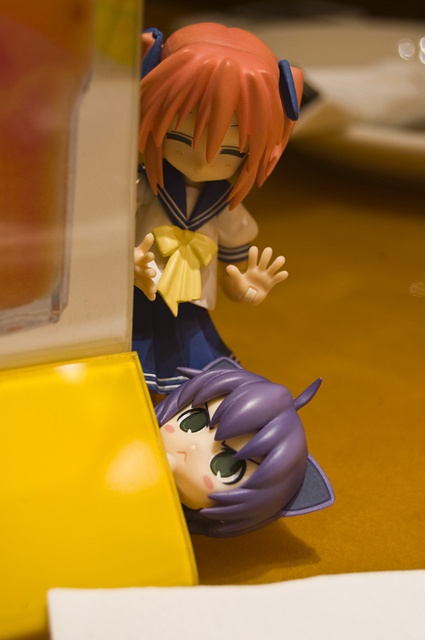
You are an artist who wants to draw the satin yellow ribbon at center from the image. What are the coordinates of its position?

The satin yellow ribbon at center is located at coordinates point (203, 186).